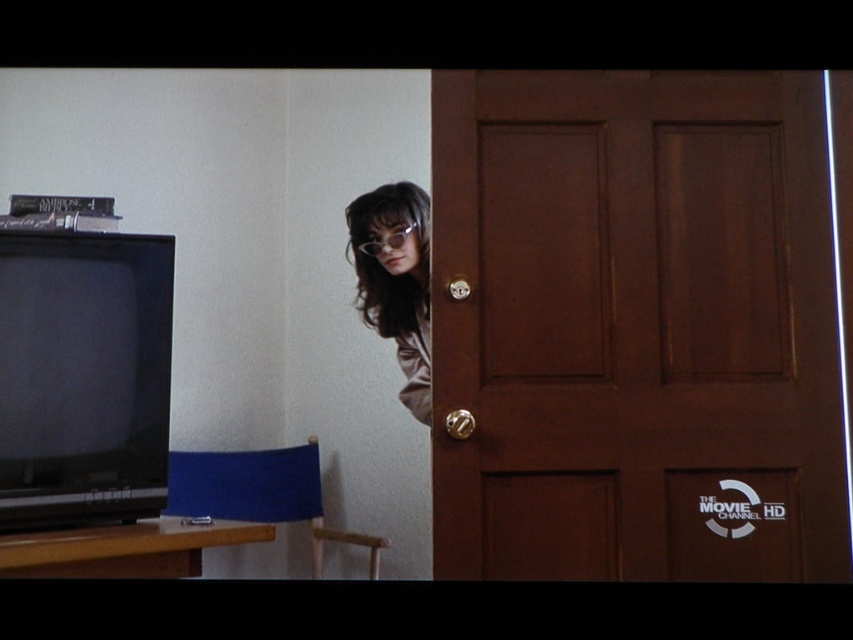
Looking at this image, is brown wooden door at center thinner than satin brown hair at upper center?

In fact, brown wooden door at center might be wider than satin brown hair at upper center.

Which is above, brown wooden door at center or satin brown hair at upper center?

satin brown hair at upper center is higher up.

Where is `brown wooden door at center`? brown wooden door at center is located at coordinates (634, 326).

You are a GUI agent. You are given a task and a screenshot of the screen. Output one action in this format:
    pyautogui.click(x=<x>, y=<y>)
    Task: Click on the brown wooden door at center
    The height and width of the screenshot is (640, 853).
    Given the screenshot: What is the action you would take?
    pyautogui.click(x=634, y=326)

Does brown wooden door at center have a lesser height compared to gold metallic door handle at center?

Incorrect, brown wooden door at center's height does not fall short of gold metallic door handle at center's.

Can you confirm if brown wooden door at center is smaller than gold metallic door handle at center?

Actually, brown wooden door at center might be larger than gold metallic door handle at center.

Locate an element on the screen. This screenshot has width=853, height=640. brown wooden door at center is located at coordinates (634, 326).

Is brown wooden door at center positioned in front of black matte television at left?

That is False.

Can you confirm if brown wooden door at center is bigger than black matte television at left?

Yes, brown wooden door at center is bigger than black matte television at left.

Between point (734, 330) and point (117, 509), which one is positioned in front?

Positioned in front is point (117, 509).

Identify the location of brown wooden door at center. Image resolution: width=853 pixels, height=640 pixels. (634, 326).